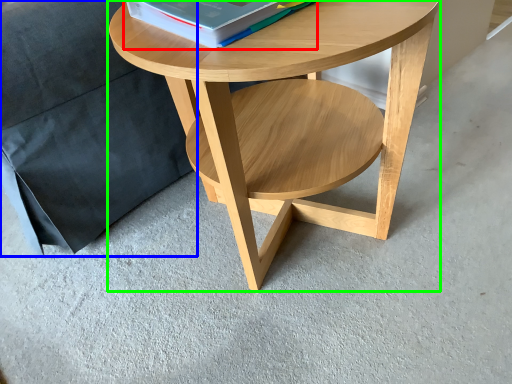
Question: Considering the real-world distances, which object is farthest from paperback book (highlighted by a red box)? pillow (highlighted by a blue box) or coffee table (highlighted by a green box)?

Choices:
 (A) pillow
 (B) coffee table

Answer: (A)